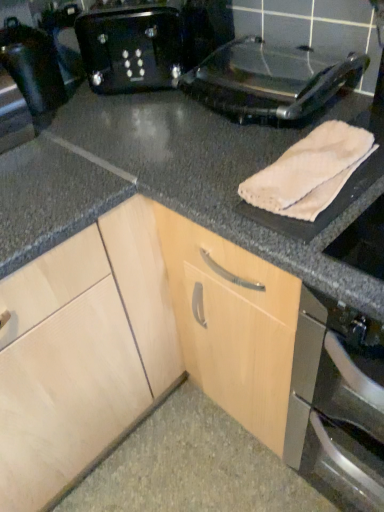
Locate an element on the screen. free space in front of black plastic toaster at upper center is located at coordinates (132, 119).